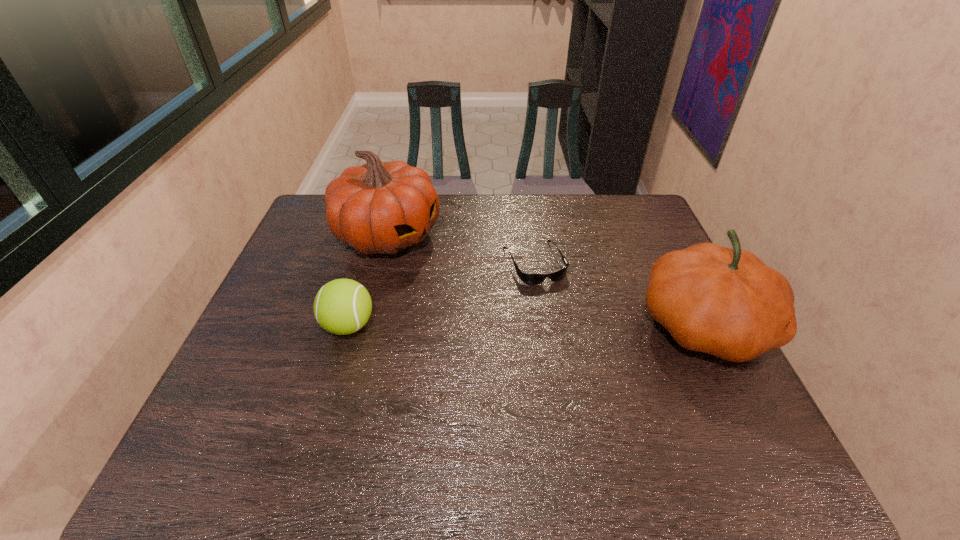
What are the coordinates of `vacant space located 0.090m on the front-facing side of the second object from right to left` in the screenshot? It's located at (557, 308).

Identify the location of vacant region located on the front-facing side of the second object from right to left. [x=586, y=364].

Find the location of `vacant space situated on the front-facing side of the second object from right to left`. vacant space situated on the front-facing side of the second object from right to left is located at coordinates (578, 348).

Locate an element on the screen. The image size is (960, 540). object located in the far edge section of the desktop is located at coordinates (381, 207).

Where is `object that is positioned at the left edge`? object that is positioned at the left edge is located at coordinates (381, 207).

This screenshot has width=960, height=540. I want to click on object positioned at the right edge, so [x=726, y=302].

The width and height of the screenshot is (960, 540). I want to click on object located in the far left corner section of the desktop, so click(x=381, y=207).

Where is `free region at the far edge of the desktop`? Image resolution: width=960 pixels, height=540 pixels. free region at the far edge of the desktop is located at coordinates (468, 212).

The image size is (960, 540). In the image, there is a desktop. What are the coordinates of `free space at the near edge` in the screenshot? It's located at (295, 416).

Locate an element on the screen. The width and height of the screenshot is (960, 540). vacant space at the left edge of the desktop is located at coordinates (273, 299).